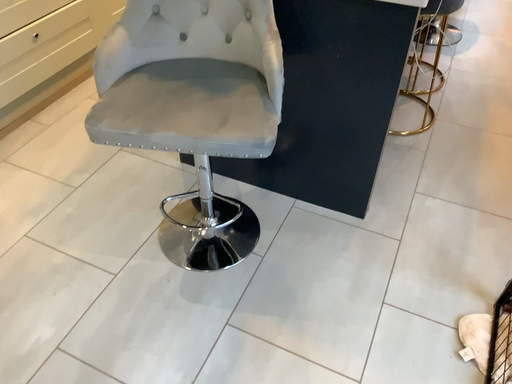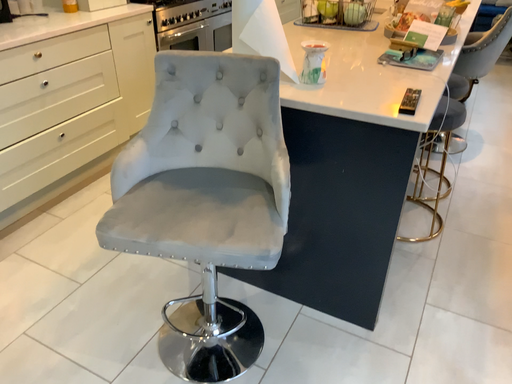
Question: How did the camera likely rotate when shooting the video?

Choices:
 (A) rotated upward
 (B) rotated downward

Answer: (A)